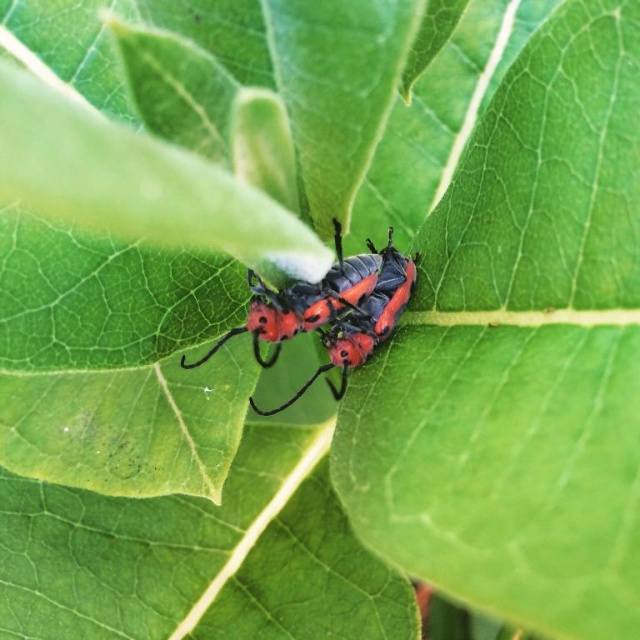
Question: Which point is farther from the camera taking this photo?

Choices:
 (A) (628, 164)
 (B) (328, 269)

Answer: (B)

Question: Is green matte leaf at center smaller than shiny red beetle at center?

Choices:
 (A) yes
 (B) no

Answer: (B)

Question: Is green matte leaf at center positioned before shiny red beetle at center?

Choices:
 (A) yes
 (B) no

Answer: (A)

Question: Does green matte leaf at center come in front of shiny red beetle at center?

Choices:
 (A) no
 (B) yes

Answer: (B)

Question: Which object is farther from the camera taking this photo?

Choices:
 (A) shiny red beetle at center
 (B) green matte leaf at center

Answer: (A)